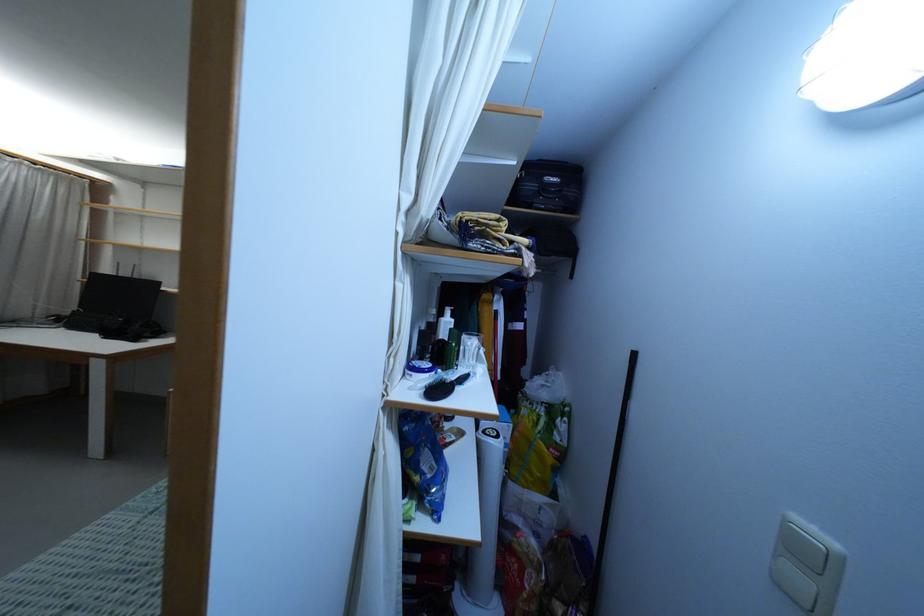
The width and height of the screenshot is (924, 616). In order to click on blue chip bag in this screenshot , I will do `click(422, 460)`.